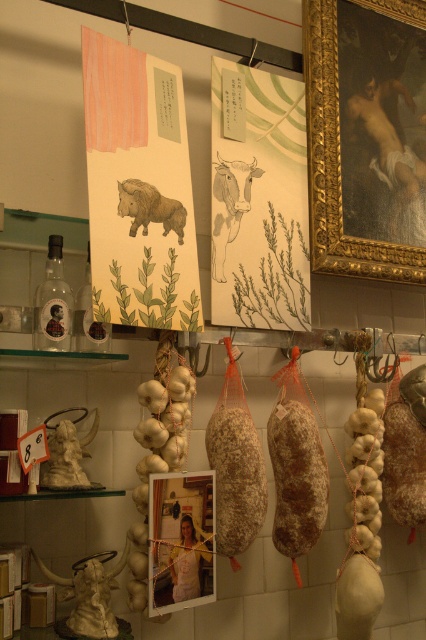
Is matte plastic photo frame at center positioned before brown paper cow at center?

Yes, it is in front of brown paper cow at center.

Does matte plastic photo frame at center have a smaller size compared to brown paper cow at center?

No, matte plastic photo frame at center is not smaller than brown paper cow at center.

Identify the location of matte plastic photo frame at center. (181, 540).

Between white marble statue at left and brown textured boar at center, which one has more height?

white marble statue at left

Between white marble statue at left and brown textured boar at center, which one is positioned lower?

white marble statue at left is lower down.

Who is more distant from viewer, (81, 442) or (157, 216)?

The point (157, 216) is more distant.

What are the coordinates of `white marble statue at left` in the screenshot? It's located at (68, 456).

Does point (313, 484) come closer to viewer compared to point (236, 163)?

Yes, it is.

Does brown textured salami at center have a lesser width compared to brown paper cow at center?

No.

Locate an element on the screen. brown textured salami at center is located at coordinates (296, 477).

Identify the location of brown textured salami at center. point(296,477).